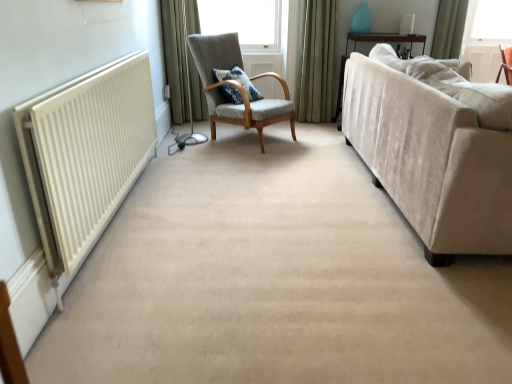
Question: Is point (391, 115) closer or farther from the camera than point (450, 44)?

Choices:
 (A) farther
 (B) closer

Answer: (B)

Question: Is beige velvet couch at right to the left or to the right of green fabric curtain at upper right, marked as the 1th curtain in a right-to-left arrangement, in the image?

Choices:
 (A) left
 (B) right

Answer: (A)

Question: Based on their relative distances, which object is farther from the green fabric curtain at upper left, the 1th curtain in the left-to-right sequence?

Choices:
 (A) green fabric curtain at upper right, marked as the 1th curtain in a right-to-left arrangement
 (B) blue patterned cushion at center
 (C) white matte radiator at left
 (D) green velvet curtain at upper center, marked as the second curtain in a left-to-right arrangement
 (E) beige velvet couch at right

Answer: (A)

Question: Estimate the real-world distances between objects in this image. Which object is closer to the blue patterned cushion at center?

Choices:
 (A) white matte radiator at left
 (B) beige velvet couch at right
 (C) green fabric curtain at upper right, which is counted as the 3th curtain, starting from the left
 (D) textured gray armchair at center
 (E) green velvet curtain at upper center, marked as the second curtain in a left-to-right arrangement

Answer: (D)